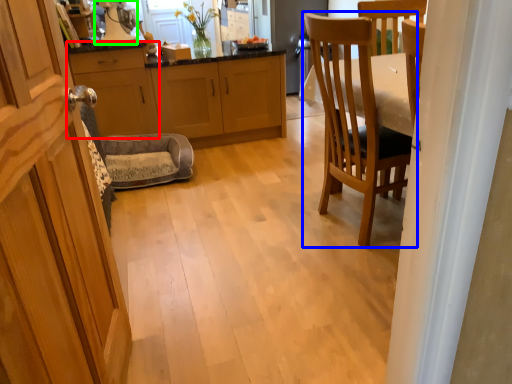
Question: Considering the real-world distances, which object is closest to cabinetry (highlighted by a red box)? chair (highlighted by a blue box) or appliance (highlighted by a green box).

Choices:
 (A) chair
 (B) appliance

Answer: (B)